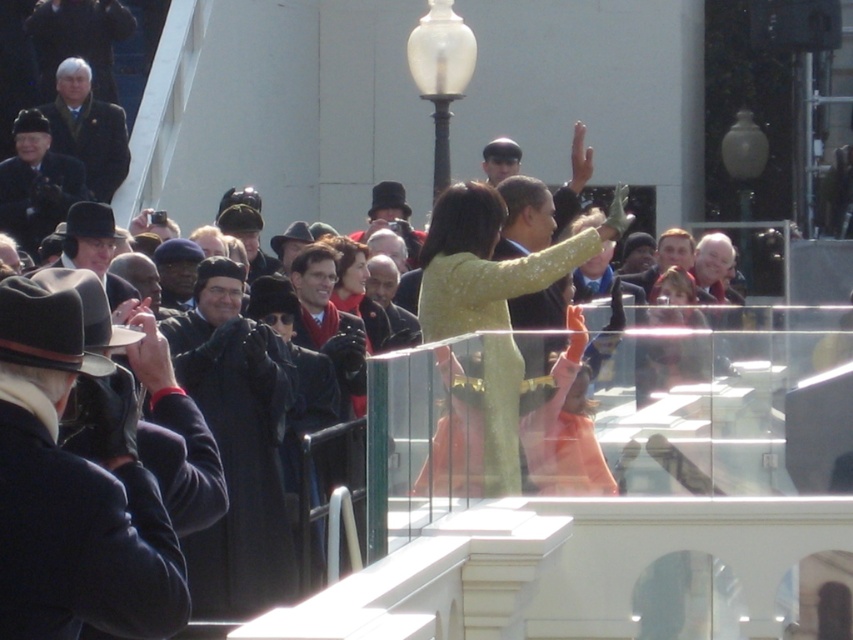
Question: Considering the real-world distances, which object is farthest from the shiny gold dress at center?

Choices:
 (A) dark gray suit at upper left
 (B) white glass lamp post at upper center
 (C) dark blue uniform at center

Answer: (A)

Question: Among these points, which one is farthest from the camera?

Choices:
 (A) (42, 218)
 (B) (485, 172)

Answer: (B)

Question: Is shiny gold dress at center wider than matte yellow dress at center?

Choices:
 (A) no
 (B) yes

Answer: (A)

Question: Observing the image, what is the correct spatial positioning of shiny gold dress at center in reference to matte black coat at center?

Choices:
 (A) below
 (B) above

Answer: (B)

Question: Can you confirm if white wool coat at upper left is smaller than matte yellow dress at center?

Choices:
 (A) yes
 (B) no

Answer: (A)

Question: Which object is farther from the camera taking this photo?

Choices:
 (A) white glass lamp post at upper center
 (B) white wool coat at upper left
 (C) dark gray suit at upper left
 (D) dark gray wool hat at left

Answer: (B)